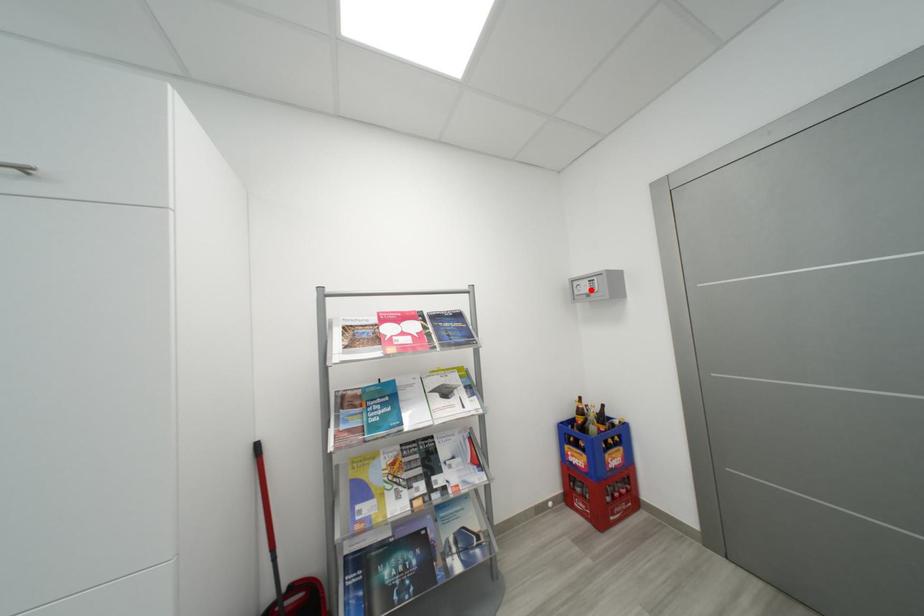
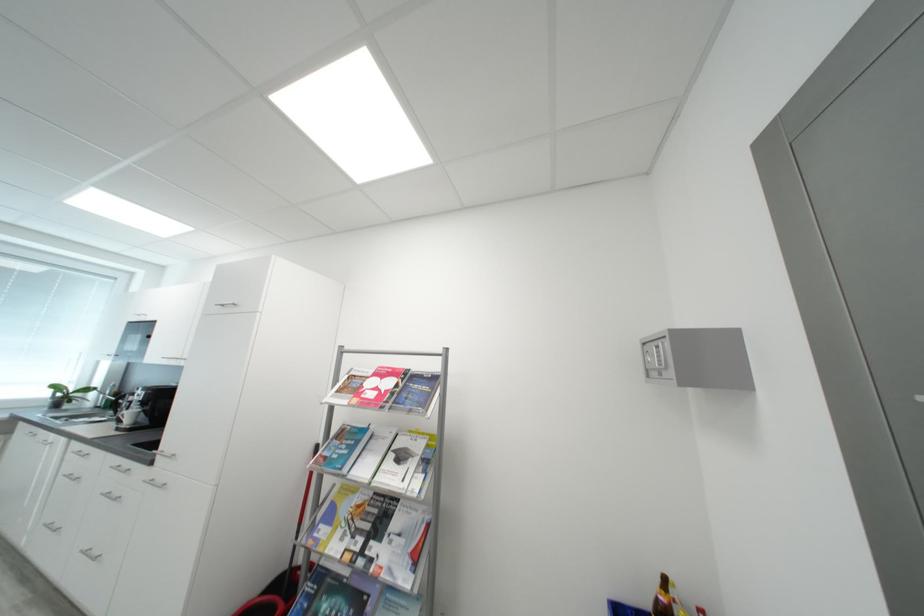
The point at the highlighted location is marked in the first image. Where is the corresponding point in the second image?

(660, 361)